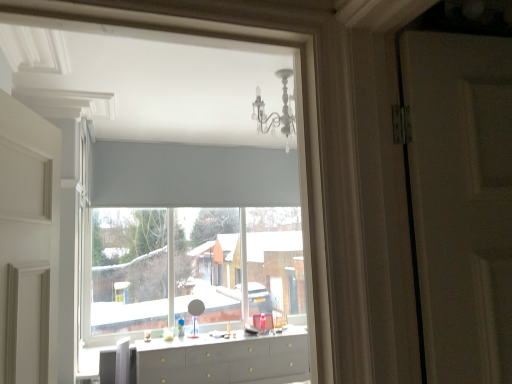
Question: Is matte gray dresser at center spatially inside white matte window at center, or outside of it?

Choices:
 (A) outside
 (B) inside

Answer: (A)

Question: Considering the positions of matte gray dresser at center and white matte window at center in the image, is matte gray dresser at center bigger or smaller than white matte window at center?

Choices:
 (A) small
 (B) big

Answer: (A)

Question: Which is farther from the matte gray dresser at center?

Choices:
 (A) white plastic swivel chair at lower left
 (B) white glossy counter top at center
 (C) white matte window at center

Answer: (C)

Question: Estimate the real-world distances between objects in this image. Which object is closer to the matte gray dresser at center?

Choices:
 (A) white matte window at center
 (B) white plastic swivel chair at lower left
 (C) white glossy counter top at center

Answer: (C)